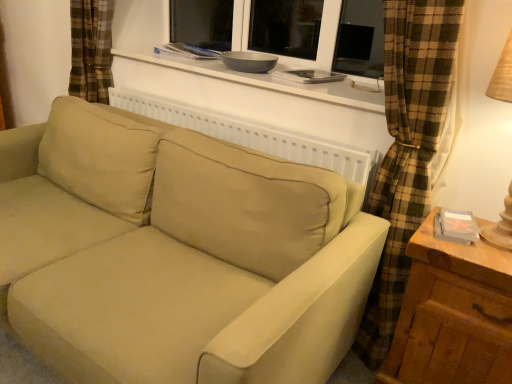
The width and height of the screenshot is (512, 384). In order to click on white matte window sill at upper center in this screenshot , I will do `click(270, 81)`.

What's the angular difference between wooden at right and beige fabric couch at center's facing directions?

They differ by 0.535 degrees in their facing directions.

Is wooden at right positioned with its back to beige fabric couch at center?

wooden at right is not turned away from beige fabric couch at center.

Considering the positions of points (510, 281) and (220, 326), is point (510, 281) closer to camera compared to point (220, 326)?

Yes, point (510, 281) is closer to viewer.

Does wooden at right have a lesser height compared to beige fabric couch at center?

Indeed, wooden at right has a lesser height compared to beige fabric couch at center.

Is point (452, 292) behind point (260, 81)?

No, (452, 292) is closer to viewer.

Is wooden at right to the right of white matte window sill at upper center from the viewer's perspective?

Indeed, wooden at right is positioned on the right side of white matte window sill at upper center.

Could you tell me if wooden at right is turned towards white matte window sill at upper center?

No, wooden at right is not turned towards white matte window sill at upper center.

Would you say wooden at right is outside white matte window sill at upper center?

Yes, wooden at right is located beyond the bounds of white matte window sill at upper center.

Is white matte window sill at upper center oriented away from beige fabric couch at center?

white matte window sill at upper center is not turned away from beige fabric couch at center.

Does white matte window sill at upper center appear on the right side of beige fabric couch at center?

Yes, white matte window sill at upper center is to the right of beige fabric couch at center.

Between white matte window sill at upper center and beige fabric couch at center, which one is positioned in front?

beige fabric couch at center is in front.

From a real-world perspective, is beige fabric couch at center located higher than wooden at right?

Indeed, from a real-world perspective, beige fabric couch at center stands above wooden at right.

Does beige fabric couch at center appear on the right side of wooden at right?

No.

Does beige fabric couch at center have a greater width compared to wooden at right?

Yes.

Is beige fabric couch at center facing away from wooden at right?

No, beige fabric couch at center is not facing away from wooden at right.

Who is bigger, white matte window sill at upper center or wooden at right?

wooden at right.

How many degrees apart are the facing directions of white matte window sill at upper center and wooden at right?

white matte window sill at upper center and wooden at right are facing 0.966 degrees away from each other.

Is point (327, 94) farther from camera compared to point (478, 308)?

Yes.

Considering the sizes of white matte window sill at upper center and wooden at right in the image, is white matte window sill at upper center wider or thinner than wooden at right?

In the image, white matte window sill at upper center appears to be wider than wooden at right.

You are a GUI agent. You are given a task and a screenshot of the screen. Output one action in this format:
    pyautogui.click(x=<x>, y=<y>)
    Task: Click on the window sill located above the beige fabric couch at center (from a real-world perspective)
    The height and width of the screenshot is (384, 512).
    Given the screenshot: What is the action you would take?
    pyautogui.click(x=270, y=81)

Considering the points (80, 163) and (378, 93), which point is in front, point (80, 163) or point (378, 93)?

The point (378, 93) is closer.

Between beige fabric couch at center and white matte window sill at upper center, which one appears on the left side from the viewer's perspective?

beige fabric couch at center is more to the left.

Could you tell me if beige fabric couch at center is turned towards white matte window sill at upper center?

No, beige fabric couch at center is not turned towards white matte window sill at upper center.

This screenshot has width=512, height=384. Identify the location of table that is on the right side of beige fabric couch at center. (452, 315).

The width and height of the screenshot is (512, 384). What are the coordinates of `window sill behind the wooden at right` in the screenshot? It's located at (270, 81).

Estimate the real-world distances between objects in this image. Which object is closer to white matte window sill at upper center, wooden at right or beige fabric couch at center?

beige fabric couch at center is positioned closer to the anchor white matte window sill at upper center.

Estimate the real-world distances between objects in this image. Which object is closer to wooden at right, white matte window sill at upper center or beige fabric couch at center?

beige fabric couch at center is positioned closer to the anchor wooden at right.

Which object lies further to the anchor point wooden at right, beige fabric couch at center or white matte window sill at upper center?

The object further to wooden at right is white matte window sill at upper center.

Considering their positions, is wooden at right positioned closer to beige fabric couch at center than white matte window sill at upper center?

wooden at right.

Looking at the image, which one is located further to white matte window sill at upper center, beige fabric couch at center or wooden at right?

Among the two, wooden at right is located further to white matte window sill at upper center.

From the image, which object appears to be nearer to beige fabric couch at center, white matte window sill at upper center or wooden at right?

wooden at right is positioned closer to the anchor beige fabric couch at center.

You are a GUI agent. You are given a task and a screenshot of the screen. Output one action in this format:
    pyautogui.click(x=<x>, y=<y>)
    Task: Click on the window sill located between beige fabric couch at center and wooden at right in the left-right direction
    
    Given the screenshot: What is the action you would take?
    pyautogui.click(x=270, y=81)